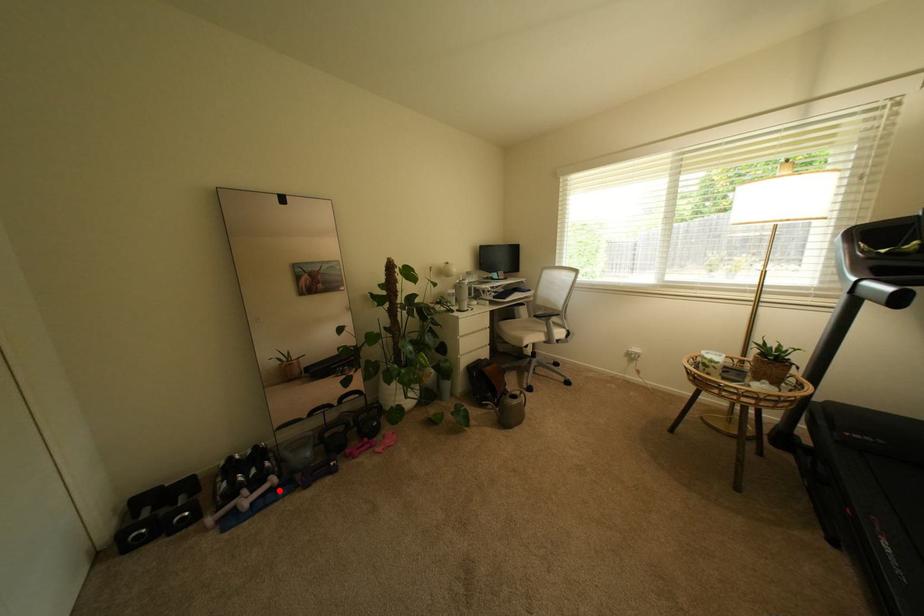
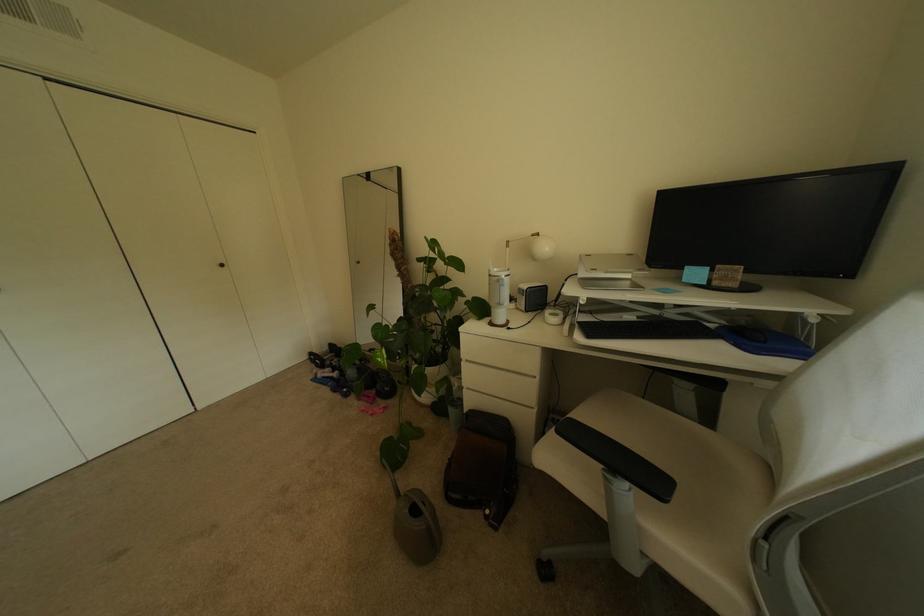
Question: I am providing you with two images of the same scene from different viewpoints. Image1 has a red point marked. In image2, the corresponding 3D location appears at what relative position? Reply with the corresponding letter.

Choices:
 (A) Closer
 (B) Farther

Answer: (B)